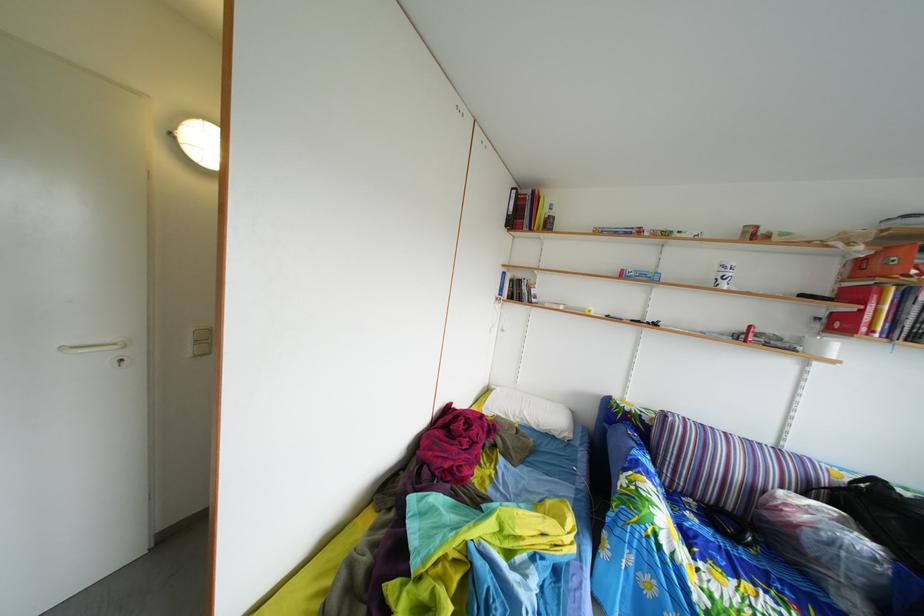
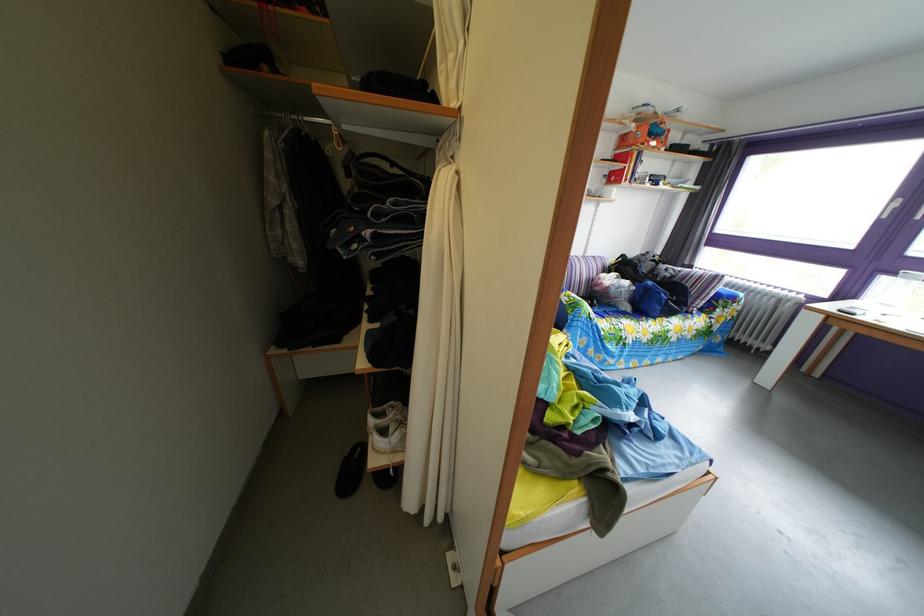
In the second image, find the point that corresponds to (x=792, y=447) in the first image.

(596, 261)